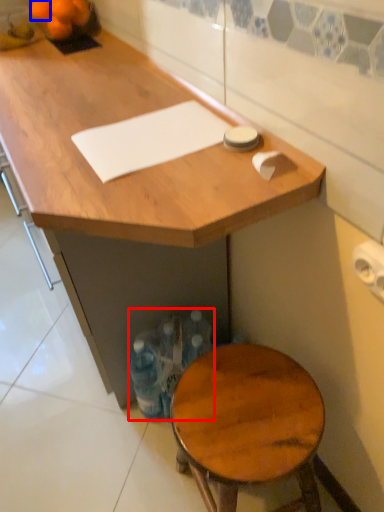
Question: Among these objects, which one is farthest to the camera, bottle (highlighted by a red box) or orange (highlighted by a blue box)?

Choices:
 (A) bottle
 (B) orange

Answer: (B)